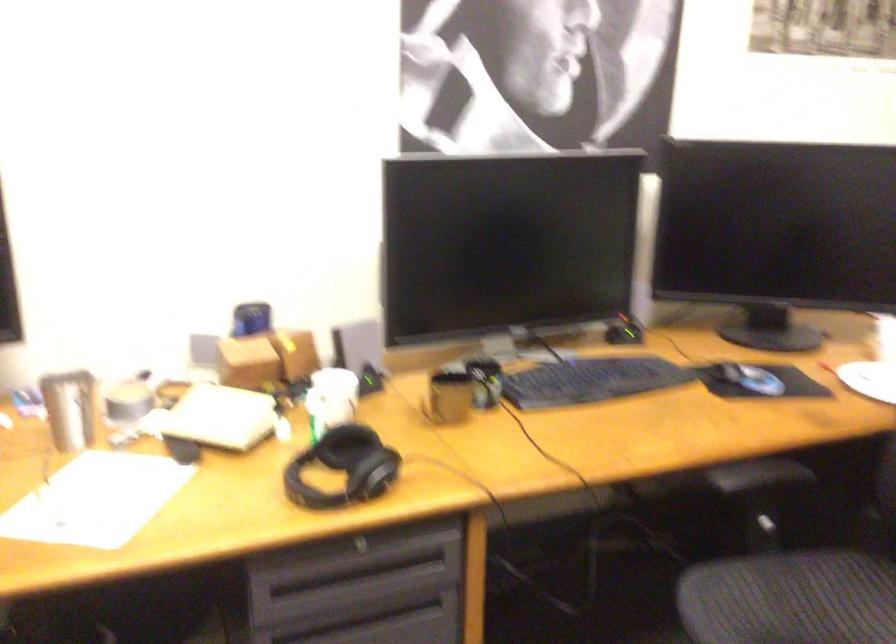
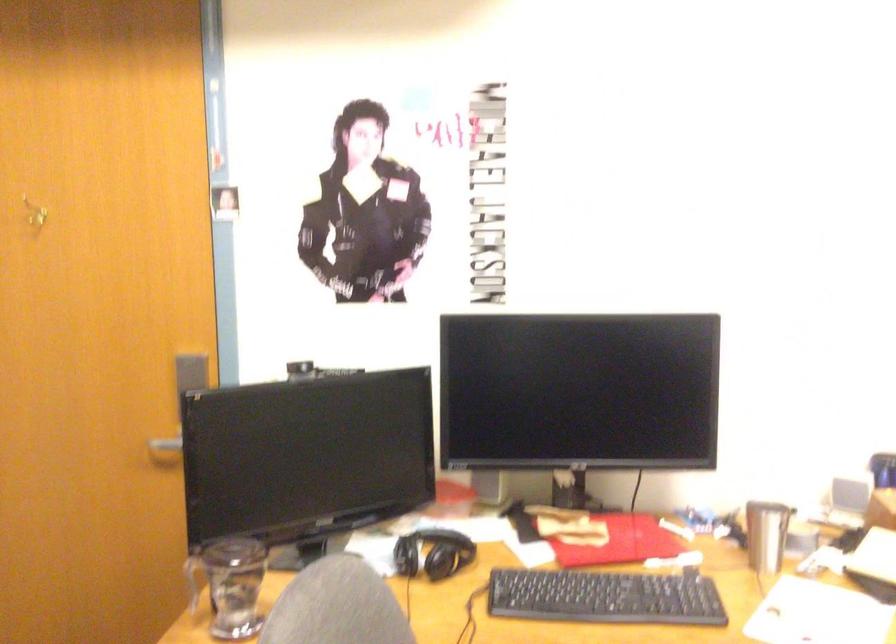
Question: Based on the continuous images, in which direction is the camera rotating? Reply with the corresponding letter.

Choices:
 (A) Left
 (B) Right
 (C) Up
 (D) Down

Answer: (A)